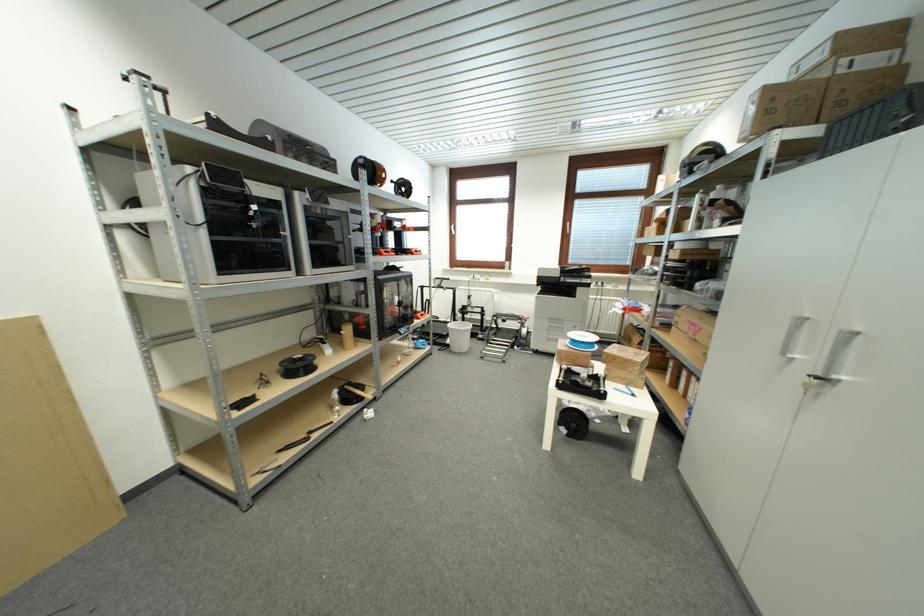
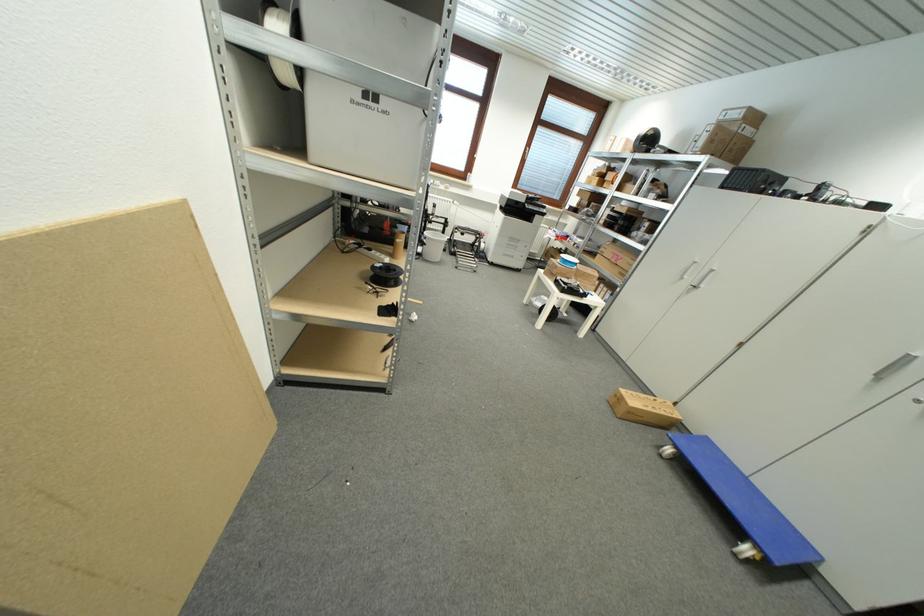
Locate, in the second image, the point that corresponds to [699,336] in the first image.

(621, 262)